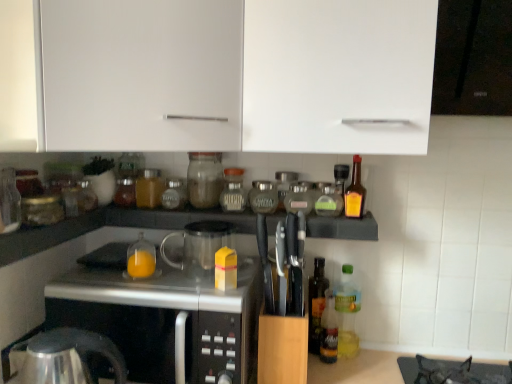
Locate an element on the screen. The image size is (512, 384). free space that is to the left of translucent glass bottle at center, the second orange juice when ordered from right to left is located at coordinates (95, 278).